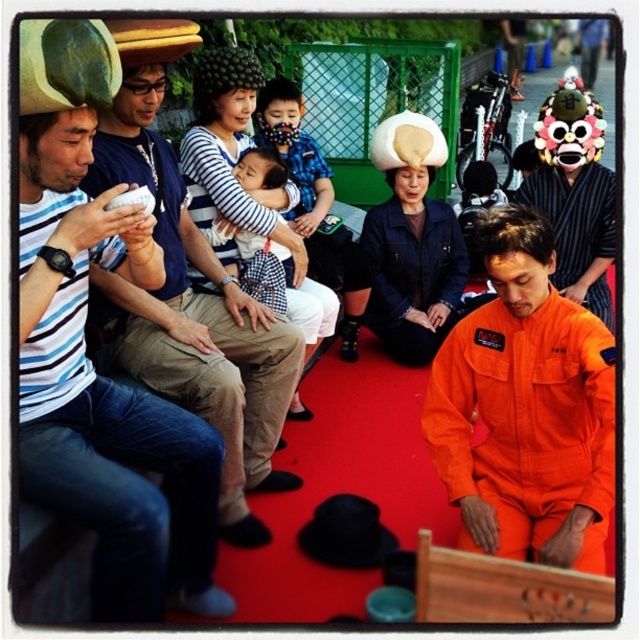
Question: Does matte striped shirt at left appear on the right side of orange fabric jumpsuit at center?

Choices:
 (A) yes
 (B) no

Answer: (B)

Question: Does matte striped shirt at left appear under orange fabric jumpsuit at center?

Choices:
 (A) yes
 (B) no

Answer: (A)

Question: Which object is the closest to the orange fabric jumpsuit at center?

Choices:
 (A) matte striped shirt at left
 (B) matte black phone at left

Answer: (B)

Question: Does matte striped shirt at left appear under checkered fabric shirt at center?

Choices:
 (A) no
 (B) yes

Answer: (B)

Question: Which of these objects is positioned farthest from the orange fabric jumpsuit at center?

Choices:
 (A) matte striped shirt at left
 (B) matte black phone at left

Answer: (A)

Question: Which of the following is the farthest from the observer?

Choices:
 (A) matte black phone at left
 (B) orange fabric jumpsuit at center
 (C) checkered fabric shirt at center

Answer: (C)